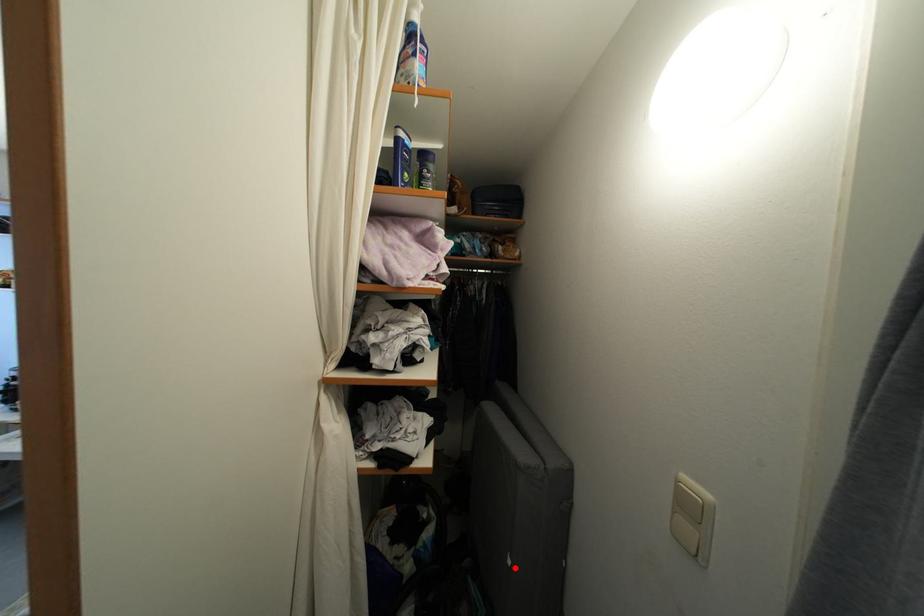
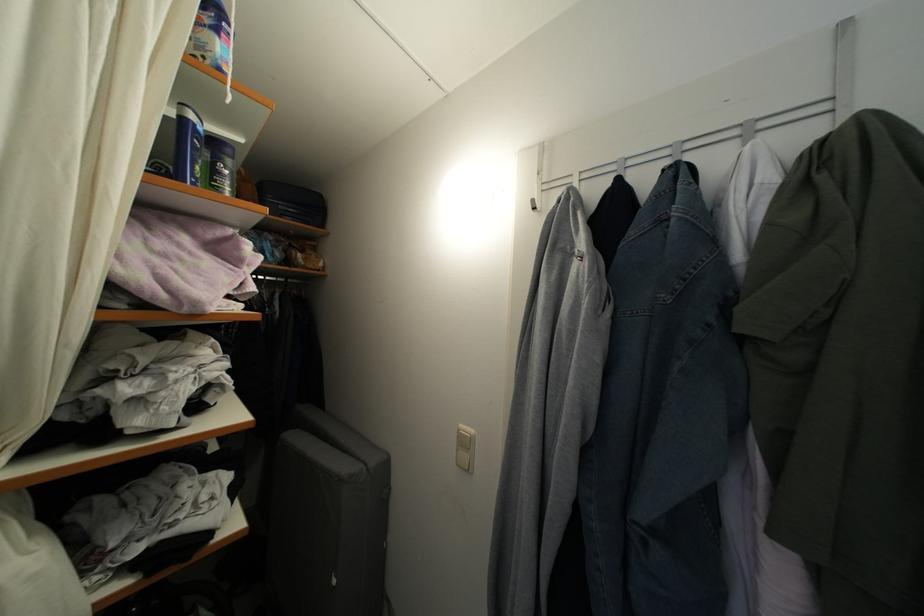
In the second image, find the point that corresponds to the highlighted location in the first image.

(339, 588)